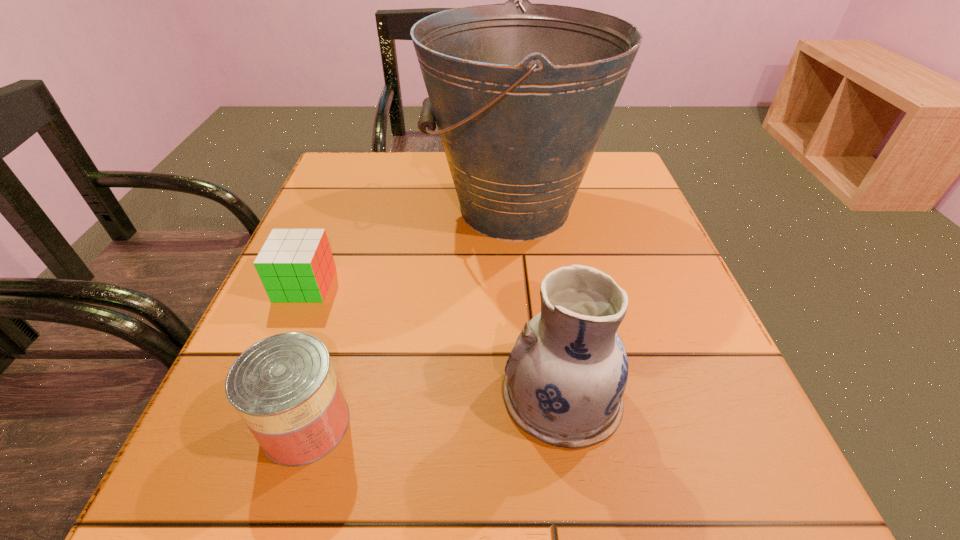
You are a GUI agent. You are given a task and a screenshot of the screen. Output one action in this format:
    pyautogui.click(x=<x>, y=<y>)
    Task: Click on the free spot that satisfies the following two spatial constraints: 1. with the handle on opposite sides of the bucket; 2. on the left side of the third shortest object
    
    Given the screenshot: What is the action you would take?
    pyautogui.click(x=533, y=395)

You are a GUI agent. You are given a task and a screenshot of the screen. Output one action in this format:
    pyautogui.click(x=<x>, y=<y>)
    Task: Click on the blank area in the image that satisfies the following two spatial constraints: 1. on the back side of the pottery; 2. with the handle on opposite sides of the tallest object
    
    Given the screenshot: What is the action you would take?
    pyautogui.click(x=533, y=208)